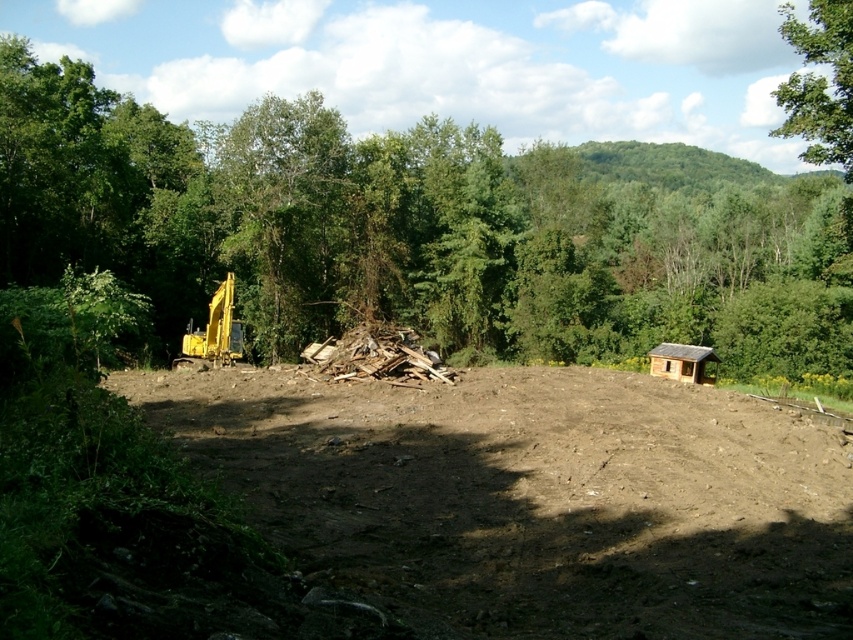
Based on the scene description, where is the green leafy tree at center located in terms of coordinates?

The green leafy tree at center is located at coordinates point (403, 230).